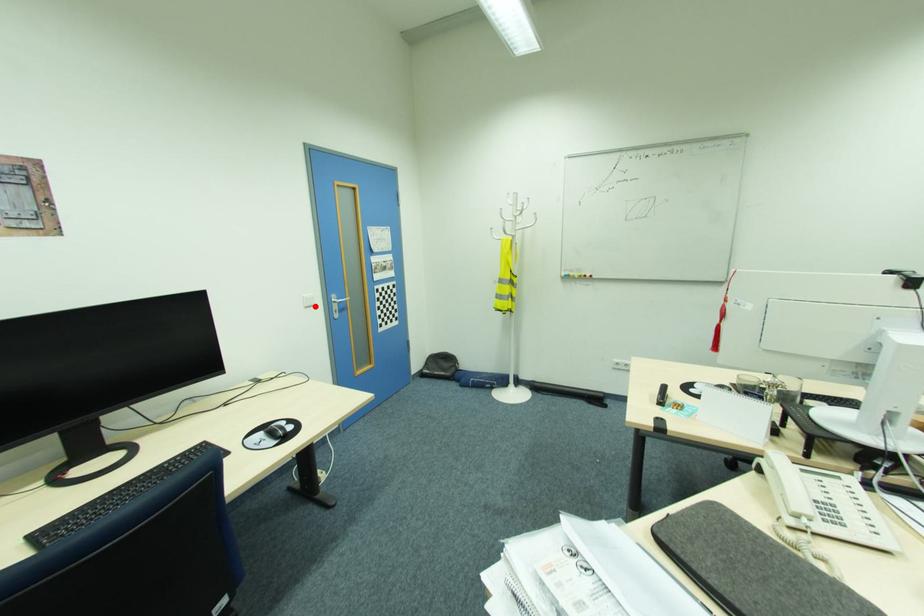
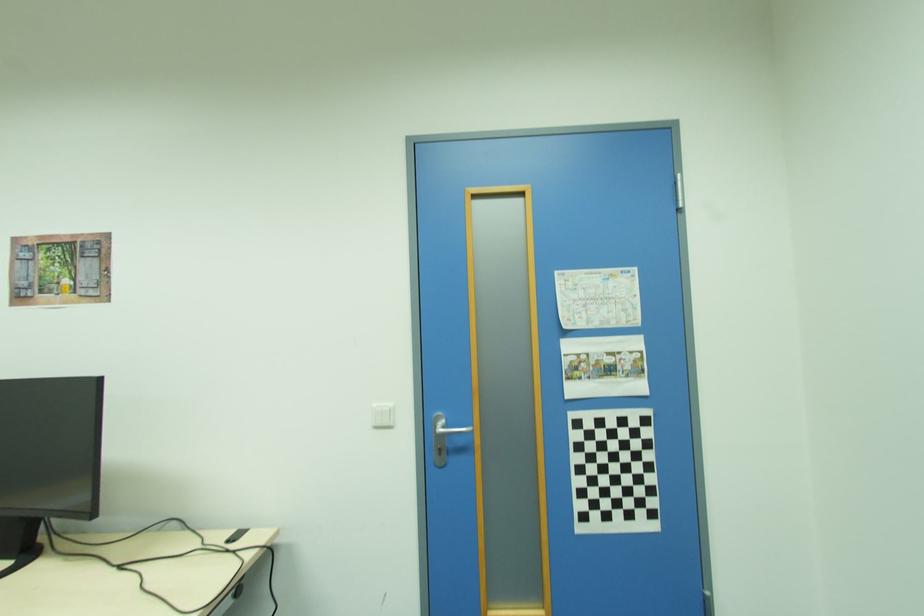
The point at the highlighted location is marked in the first image. Where is the corresponding point in the second image?

(394, 427)